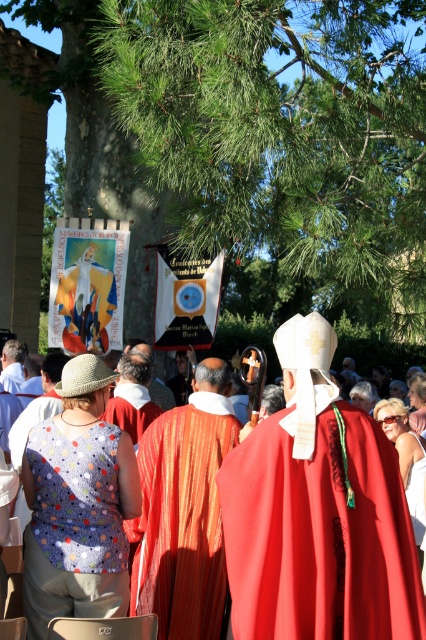
Question: Which of the following is the farthest from the observer?

Choices:
 (A) (152, 486)
 (B) (281, 550)

Answer: (A)

Question: Can you confirm if red velvet cape at center is positioned above orange silk robe at center?

Choices:
 (A) no
 (B) yes

Answer: (B)

Question: Which object is positioned farthest from the matte red cape at center?

Choices:
 (A) orange silk robe at center
 (B) red velvet cape at center

Answer: (A)

Question: Is red velvet cape at center to the right of orange silk robe at center from the viewer's perspective?

Choices:
 (A) yes
 (B) no

Answer: (A)

Question: Which point is closer to the camera taking this photo?

Choices:
 (A) (261, 541)
 (B) (330, 577)

Answer: (B)

Question: Does matte red cape at center come in front of orange silk robe at center?

Choices:
 (A) yes
 (B) no

Answer: (A)